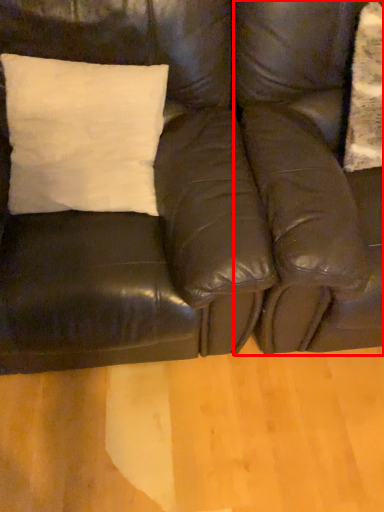
Question: Where is swivel chair (annotated by the red box) located in relation to studio couch in the image?

Choices:
 (A) left
 (B) right

Answer: (B)